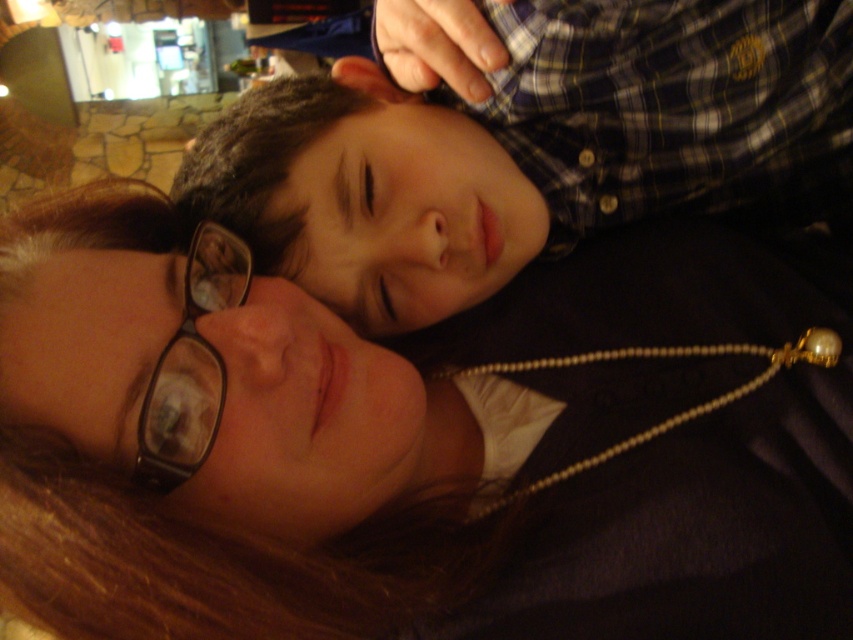
Consider the image. You are a photographer trying to capture the interaction between the plaid shirt at upper center and the black plastic glasses at lower left. Which object should you focus on first if you want to capture the subject closer to the camera?

The black plastic glasses at lower left should be focused on first because it is closer to the camera than the plaid shirt at upper center.

You are a photographer trying to capture the perfect shot of the brown hair at upper center and the plaid shirt at upper center in this scene. To ensure both elements are in focus, you need to know their vertical positions. Which one is positioned lower in the frame?

The brown hair at upper center is located below the plaid shirt at upper center, so the brown hair at upper center is positioned lower in the frame.

What is located at the coordinate point [419,448] in the image?

At point [419,448] lies brown hair at upper center.